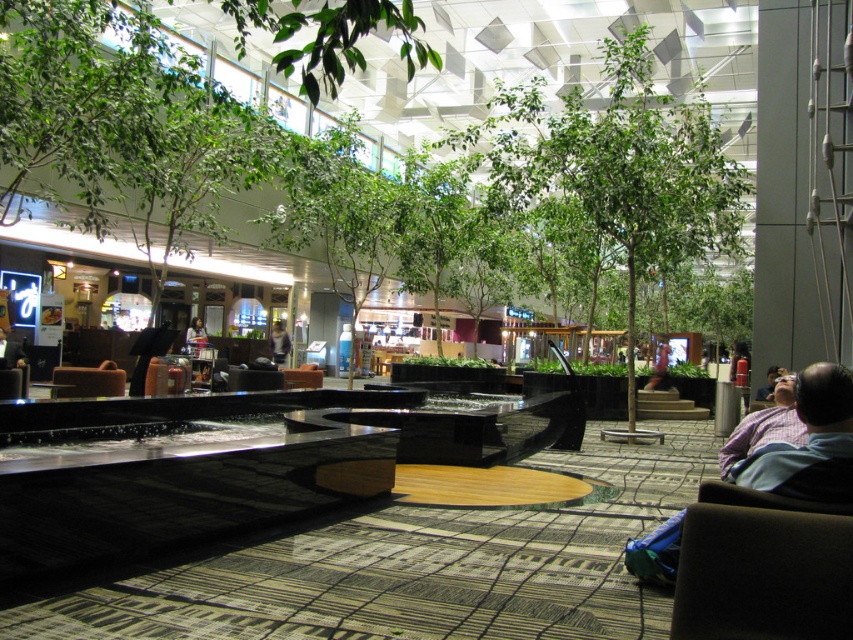
You are a customer in the atrium and want to sit down. You see the brown fabric armchair at lower right and the light brown leather jacket at center. Which object is positioned to the right of the other?

The brown fabric armchair at lower right is to the right of the light brown leather jacket at center.

You are standing in the atrium and want to take a photo of the point at coordinates [657,266]. If your camera has a maximum focus range of 15 meters, will you be able to focus on that point?

The distance of point [657,266] from viewer is 15.52 meters, so the camera cannot focus on it since it exceeds the maximum range of 15 meters.

You are a customer in the atrium and want to sit down. You see the brown leather armchair at center and the light brown leather jacket at center. Which object can you sit on?

The brown leather armchair at center can be sat on, as it is a seating option, while the light brown leather jacket at center is an article of clothing and cannot be sat upon.